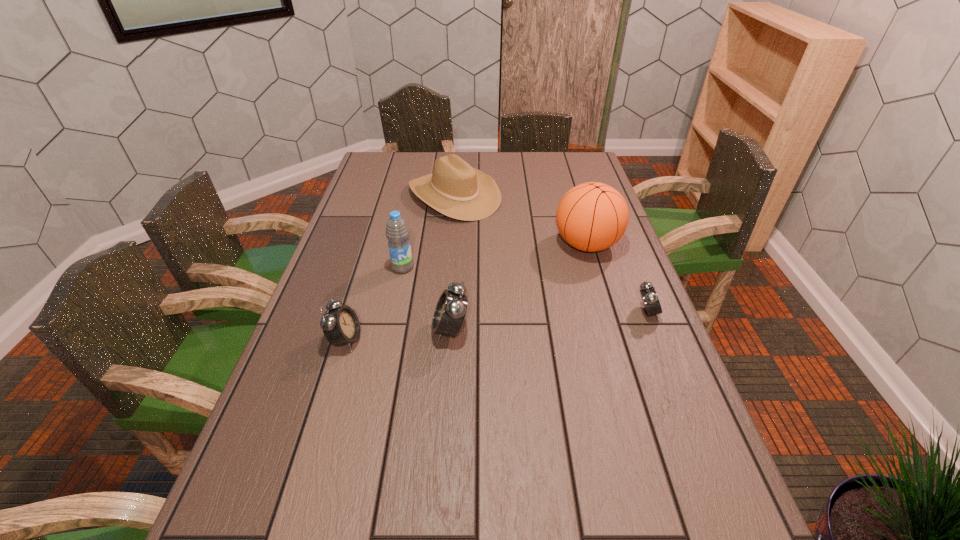
Locate an element on the screen. The image size is (960, 540). vacant space located on the face of the tallest alarm clock is located at coordinates (405, 330).

At what (x,y) coordinates should I click in order to perform the action: click on vacant area located 0.130m on the face of the tallest alarm clock. Please return your answer as a coordinate pair (x, y). The height and width of the screenshot is (540, 960). Looking at the image, I should click on (382, 330).

This screenshot has height=540, width=960. In order to click on free space located 0.050m on the front of the cowboy hat in this screenshot , I will do `click(451, 232)`.

At what (x,y) coordinates should I click in order to perform the action: click on vacant position located on the left of the basketball. Please return your answer as a coordinate pair (x, y). The height and width of the screenshot is (540, 960). Looking at the image, I should click on (466, 244).

Identify the location of free space located on the left of the water bottle. (365, 267).

Locate an element on the screen. object present at the far edge is located at coordinates (455, 189).

Find the location of a particular element. object that is at the left edge is located at coordinates (341, 326).

Locate an element on the screen. The width and height of the screenshot is (960, 540). alarm clock positioned at the right edge is located at coordinates (649, 297).

Image resolution: width=960 pixels, height=540 pixels. I want to click on basketball at the right edge, so click(593, 216).

Where is `vacant space at the far edge of the desktop`? vacant space at the far edge of the desktop is located at coordinates click(540, 162).